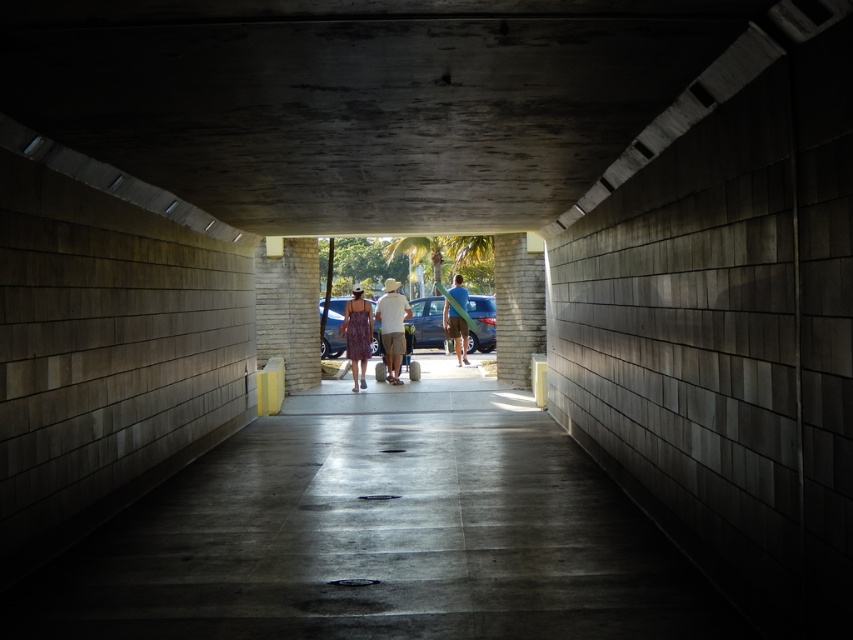
You are standing at the entrance of the tunnel and want to know if the matte white shirt at center is taller than the green surfboard at center. Can you determine this based on the scene?

The matte white shirt at center is not as tall as green surfboard at center, so the green surfboard at center is taller.

You are standing at the entrance of the tunnel and want to know if a 10 feet long ladder can fit between the concrete ceiling at center and the metallic blue car at center. Can it?

The concrete ceiling at center and metallic blue car at center are 54.11 feet apart from each other. Since the ladder is only 10 feet long, it will easily fit between them.

You are standing at the entrance of the tunnel and see both the matte white shirt at center and the matte purple dress at center. Which one do you think has a greater width when viewed from your current position?

The matte white shirt at center might be wider than matte purple dress at center according to the description.